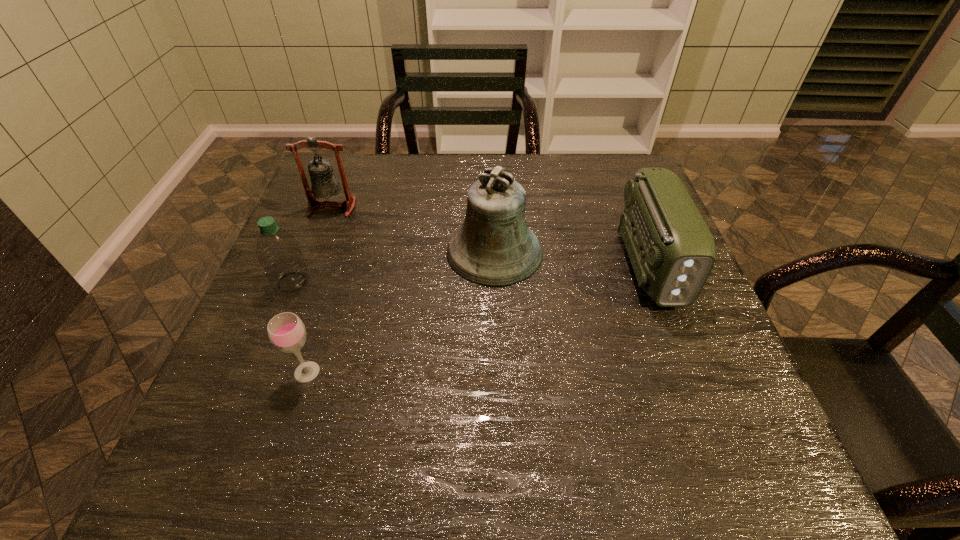
You are a GUI agent. You are given a task and a screenshot of the screen. Output one action in this format:
    pyautogui.click(x=<x>, y=<y>)
    Task: Click on the right bell
    The image size is (960, 540).
    Given the screenshot: What is the action you would take?
    pyautogui.click(x=494, y=247)

I want to click on the nearer bell, so click(494, 247).

At what (x,y) coordinates should I click in order to perform the action: click on the farthest object. Please return your answer as a coordinate pair (x, y). The height and width of the screenshot is (540, 960). Looking at the image, I should click on (324, 184).

At what (x,y) coordinates should I click in order to perform the action: click on the farther bell. Please return your answer as a coordinate pair (x, y). The image size is (960, 540). Looking at the image, I should click on (324, 184).

The height and width of the screenshot is (540, 960). I want to click on the rightmost object, so click(672, 251).

I want to click on water bottle, so click(x=278, y=252).

This screenshot has width=960, height=540. I want to click on the shortest object, so click(286, 331).

Identify the location of the nearest object. The width and height of the screenshot is (960, 540). (286, 331).

Identify the location of vacant space located on the front of the right bell. The image size is (960, 540). (497, 338).

The image size is (960, 540). I want to click on free location located on the front of the farthest object, so click(290, 318).